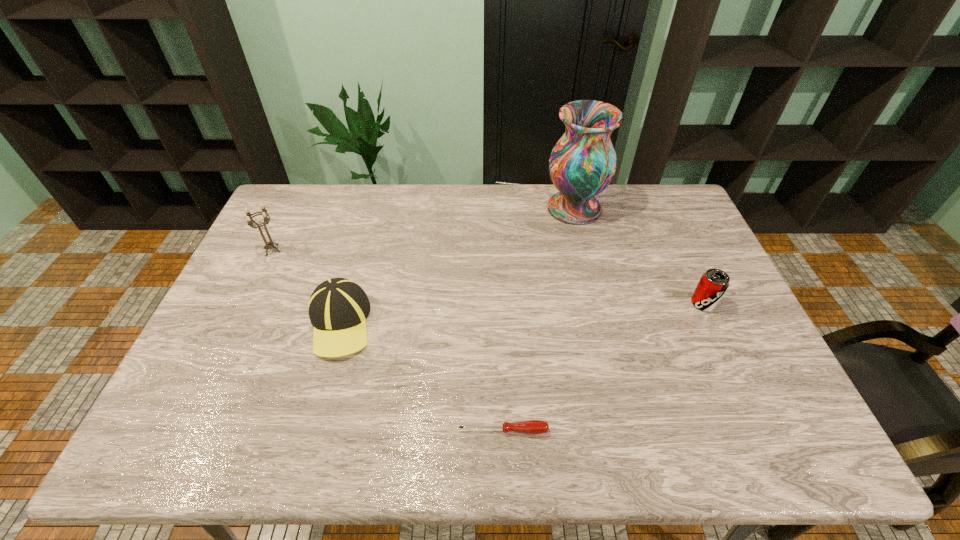
Where is `the second object from right to left`? This screenshot has height=540, width=960. the second object from right to left is located at coordinates (582, 164).

Locate an element on the screen. This screenshot has height=540, width=960. vase is located at coordinates (582, 164).

You are a GUI agent. You are given a task and a screenshot of the screen. Output one action in this format:
    pyautogui.click(x=<x>, y=<y>)
    Task: Click on the second farthest object
    
    Given the screenshot: What is the action you would take?
    pyautogui.click(x=250, y=221)

Locate an element on the screen. The height and width of the screenshot is (540, 960). the leftmost object is located at coordinates (250, 221).

The height and width of the screenshot is (540, 960). I want to click on the rightmost object, so 713,284.

The image size is (960, 540). Identify the location of the fourth object from right to left. (338, 307).

Find the location of a particular element. screwdriver is located at coordinates (535, 427).

You are a GUI agent. You are given a task and a screenshot of the screen. Output one action in this format:
    pyautogui.click(x=<x>, y=<y>)
    Task: Click on the shortest object
    This screenshot has width=960, height=540.
    Given the screenshot: What is the action you would take?
    pyautogui.click(x=535, y=427)

You are a GUI agent. You are given a task and a screenshot of the screen. Output one action in this format:
    pyautogui.click(x=<x>, y=<y>)
    Task: Click on the vacant space located 0.220m on the left of the vase
    Image resolution: width=960 pixels, height=540 pixels.
    Given the screenshot: What is the action you would take?
    pyautogui.click(x=482, y=208)

Where is `free point located 0.340m on the front of the leftmost object`? free point located 0.340m on the front of the leftmost object is located at coordinates (226, 347).